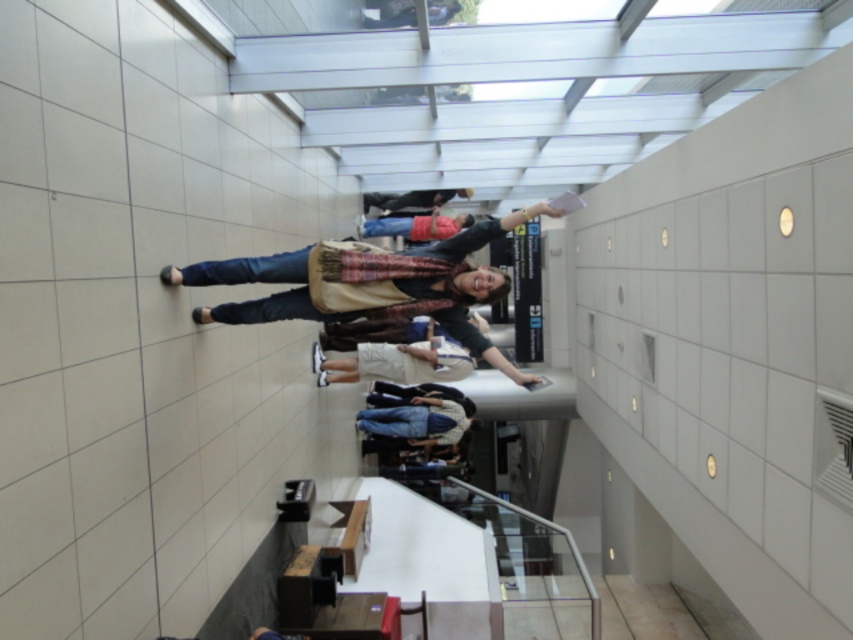
You are a security camera in the corridor. You need to determine which object is nearer to you between the denim jeans at center and the matte black backpack at center. Which one is closer?

The denim jeans at center is closer to the viewer than the matte black backpack at center.

You are a security camera monitoring the corridor. You notice a person wearing denim jeans at center and a matte black backpack at center. Which item is taller?

The denim jeans at center is taller than the matte black backpack at center.